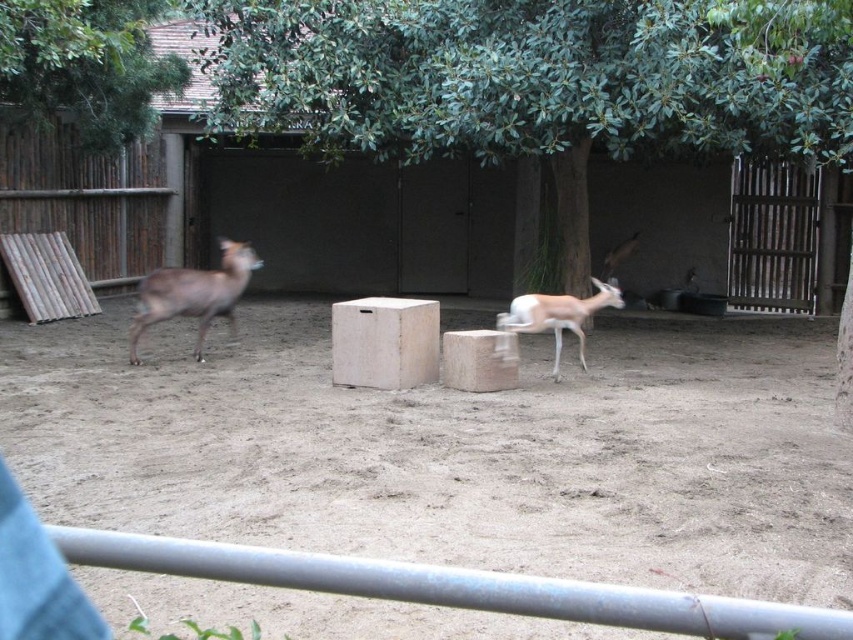
Does brown wooden gate at right have a lesser height compared to brown matte deer at left?

No.

Locate an element on the screen. brown wooden gate at right is located at coordinates (772, 236).

How far apart are brown dirt field at center and brown matte deer at left?

brown dirt field at center is 5.15 meters away from brown matte deer at left.

Is brown dirt field at center wider than brown matte deer at left?

No.

Does point (235, 534) come closer to viewer compared to point (242, 250)?

Yes, it is.

The image size is (853, 640). Identify the location of brown dirt field at center. (451, 451).

Is brown wooden fence at left thinner than light brown fur antelope at center?

In fact, brown wooden fence at left might be wider than light brown fur antelope at center.

What do you see at coordinates (86, 196) in the screenshot?
I see `brown wooden fence at left` at bounding box center [86, 196].

What do you see at coordinates (86, 196) in the screenshot? I see `brown wooden fence at left` at bounding box center [86, 196].

Where is `brown wooden fence at left`? This screenshot has width=853, height=640. brown wooden fence at left is located at coordinates (86, 196).